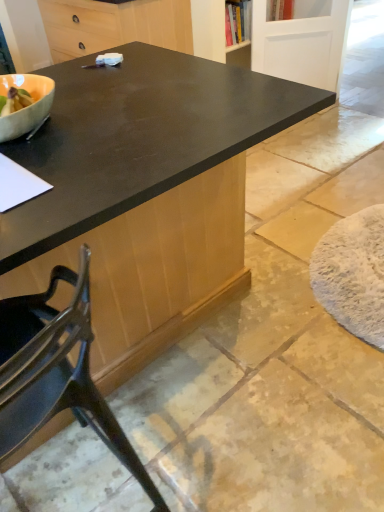
The height and width of the screenshot is (512, 384). I want to click on metallic black chair at lower left, so click(x=56, y=372).

Measure the distance between point (291,63) and camera.

Point (291,63) is 3.07 meters away from camera.

This screenshot has height=512, width=384. I want to click on metallic black chair at lower left, so click(x=56, y=372).

Does white painted wood screen door at upper right have a larger size compared to black matte cabinet at upper center?

No.

Do you think white painted wood screen door at upper right is within black matte cabinet at upper center, or outside of it?

white painted wood screen door at upper right is spatially situated outside black matte cabinet at upper center.

Does white painted wood screen door at upper right have a greater height compared to black matte cabinet at upper center?

Indeed, white painted wood screen door at upper right has a greater height compared to black matte cabinet at upper center.

From the picture: Considering the relative sizes of white painted wood screen door at upper right and black matte cabinet at upper center in the image provided, is white painted wood screen door at upper right thinner than black matte cabinet at upper center?

Correct, the width of white painted wood screen door at upper right is less than that of black matte cabinet at upper center.

Where is `chair on the right side of black matte cabinet at upper center`? The image size is (384, 512). chair on the right side of black matte cabinet at upper center is located at coordinates (56, 372).

From the image's perspective, relative to black matte cabinet at upper center, is metallic black chair at lower left above or below?

metallic black chair at lower left is situated lower than black matte cabinet at upper center in the image.

In terms of width, does metallic black chair at lower left look wider or thinner when compared to black matte cabinet at upper center?

In the image, metallic black chair at lower left appears to be more narrow than black matte cabinet at upper center.

Is black matte cabinet at upper center surrounded by metallic black chair at lower left?

That's incorrect, black matte cabinet at upper center is not inside metallic black chair at lower left.

Which object is positioned more to the left, black matte cabinet at upper center or metallic black chair at lower left?

From the viewer's perspective, black matte cabinet at upper center appears more on the left side.

Does black matte cabinet at upper center have a larger size compared to metallic black chair at lower left?

Indeed, black matte cabinet at upper center has a larger size compared to metallic black chair at lower left.

Do you think black matte cabinet at upper center is within metallic black chair at lower left, or outside of it?

black matte cabinet at upper center cannot be found inside metallic black chair at lower left.

From a real-world perspective, is black matte cabinet at upper center below metallic black chair at lower left?

No, from a real-world perspective, black matte cabinet at upper center is not beneath metallic black chair at lower left.

Would you say white painted wood screen door at upper right is part of metallic black chair at lower left's contents?

No, white painted wood screen door at upper right is not surrounded by metallic black chair at lower left.

Considering the relative sizes of metallic black chair at lower left and white painted wood screen door at upper right in the image provided, is metallic black chair at lower left shorter than white painted wood screen door at upper right?

Incorrect, the height of metallic black chair at lower left does not fall short of that of white painted wood screen door at upper right.

Find the location of `screen door on the right of metallic black chair at lower left`. screen door on the right of metallic black chair at lower left is located at coordinates (302, 42).

From a real-world perspective, is metallic black chair at lower left below white painted wood screen door at upper right?

No, from a real-world perspective, metallic black chair at lower left is not beneath white painted wood screen door at upper right.

Could you tell me if black matte cabinet at upper center is turned towards white painted wood screen door at upper right?

No.

Does black matte cabinet at upper center come behind white painted wood screen door at upper right?

No, black matte cabinet at upper center is closer to the viewer.

Which of these two, black matte cabinet at upper center or white painted wood screen door at upper right, is bigger?

black matte cabinet at upper center.

Does black matte cabinet at upper center have a lesser width compared to white painted wood screen door at upper right?

Incorrect, the width of black matte cabinet at upper center is not less than that of white painted wood screen door at upper right.

The image size is (384, 512). Find the location of `chair on the left of white painted wood screen door at upper right`. chair on the left of white painted wood screen door at upper right is located at coordinates (56, 372).

From a real-world perspective, who is located higher, white painted wood screen door at upper right or metallic black chair at lower left?

metallic black chair at lower left.

Is white painted wood screen door at upper right bigger than metallic black chair at lower left?

No, white painted wood screen door at upper right is not bigger than metallic black chair at lower left.

From their relative heights in the image, would you say white painted wood screen door at upper right is taller or shorter than metallic black chair at lower left?

Considering their sizes, white painted wood screen door at upper right has less height than metallic black chair at lower left.

You are a GUI agent. You are given a task and a screenshot of the screen. Output one action in this format:
    pyautogui.click(x=<x>, y=<y>)
    Task: Click on the screen door below the black matte cabinet at upper center (from the image's perspective)
    This screenshot has width=384, height=512.
    Given the screenshot: What is the action you would take?
    (x=302, y=42)

Locate an element on the screen. The height and width of the screenshot is (512, 384). cabinetry above the metallic black chair at lower left (from the image's perspective) is located at coordinates (114, 25).

When comparing their distances from black matte cabinet at upper center, does white painted wood screen door at upper right or metallic black chair at lower left seem further?

metallic black chair at lower left.

Considering their positions, is metallic black chair at lower left positioned further to black matte cabinet at upper center than white painted wood screen door at upper right?

metallic black chair at lower left.

Looking at the image, which one is located further to metallic black chair at lower left, white painted wood screen door at upper right or black matte cabinet at upper center?

white painted wood screen door at upper right.

Based on their spatial positions, is black matte cabinet at upper center or metallic black chair at lower left closer to white painted wood screen door at upper right?

Among the two, black matte cabinet at upper center is located nearer to white painted wood screen door at upper right.

Which object lies nearer to the anchor point white painted wood screen door at upper right, metallic black chair at lower left or black matte cabinet at upper center?

black matte cabinet at upper center is closer to white painted wood screen door at upper right.

Estimate the real-world distances between objects in this image. Which object is further from metallic black chair at lower left, black matte cabinet at upper center or white painted wood screen door at upper right?

The object further to metallic black chair at lower left is white painted wood screen door at upper right.

Locate an element on the screen. The image size is (384, 512). cabinetry between metallic black chair at lower left and white painted wood screen door at upper right in the front-back direction is located at coordinates (114, 25).